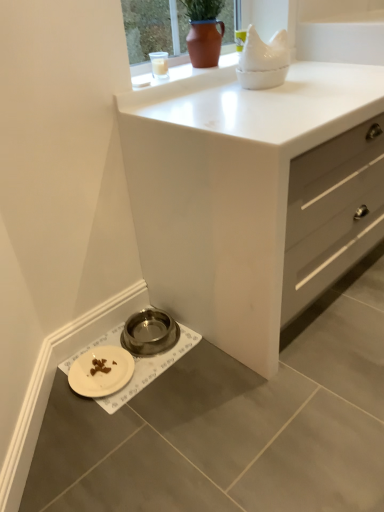
Question: Can you confirm if white matte chest of drawers at center is thinner than matte brown pot at upper center?

Choices:
 (A) no
 (B) yes

Answer: (A)

Question: Considering the relative sizes of white matte chest of drawers at center and matte brown pot at upper center in the image provided, is white matte chest of drawers at center shorter than matte brown pot at upper center?

Choices:
 (A) no
 (B) yes

Answer: (A)

Question: Is white matte chest of drawers at center aimed at matte brown pot at upper center?

Choices:
 (A) yes
 (B) no

Answer: (B)

Question: Is the position of white matte chest of drawers at center more distant than that of matte brown pot at upper center?

Choices:
 (A) yes
 (B) no

Answer: (B)

Question: Is white matte chest of drawers at center beside matte brown pot at upper center?

Choices:
 (A) no
 (B) yes

Answer: (A)

Question: Based on their sizes in the image, would you say white matte plate at lower left is bigger or smaller than white matte pet bowl at lower left?

Choices:
 (A) big
 (B) small

Answer: (B)

Question: From the image's perspective, relative to white matte pet bowl at lower left, is white matte plate at lower left above or below?

Choices:
 (A) above
 (B) below

Answer: (B)

Question: Is white matte plate at lower left taller or shorter than white matte pet bowl at lower left?

Choices:
 (A) short
 (B) tall

Answer: (B)

Question: Is point (84, 388) closer or farther from the camera than point (132, 390)?

Choices:
 (A) farther
 (B) closer

Answer: (A)

Question: From a real-world perspective, is metallic bowl at lower left above or below white matte chest of drawers at center?

Choices:
 (A) above
 (B) below

Answer: (B)

Question: Relative to white matte chest of drawers at center, is metallic bowl at lower left in front or behind?

Choices:
 (A) behind
 (B) front

Answer: (A)

Question: Is metallic bowl at lower left taller or shorter than white matte chest of drawers at center?

Choices:
 (A) short
 (B) tall

Answer: (A)

Question: Is metallic bowl at lower left inside or outside of white matte chest of drawers at center?

Choices:
 (A) inside
 (B) outside

Answer: (B)

Question: Considering the positions of white matte pet bowl at lower left and white matte chest of drawers at center in the image, is white matte pet bowl at lower left wider or thinner than white matte chest of drawers at center?

Choices:
 (A) wide
 (B) thin

Answer: (B)

Question: Is white matte pet bowl at lower left bigger or smaller than white matte chest of drawers at center?

Choices:
 (A) big
 (B) small

Answer: (B)